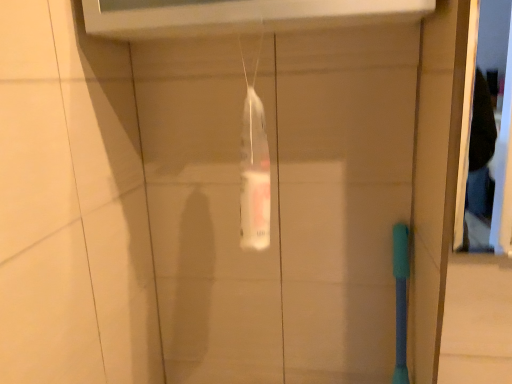
Question: Should I look upward or downward to see transparent plastic shower at center?

Choices:
 (A) up
 (B) down

Answer: (A)